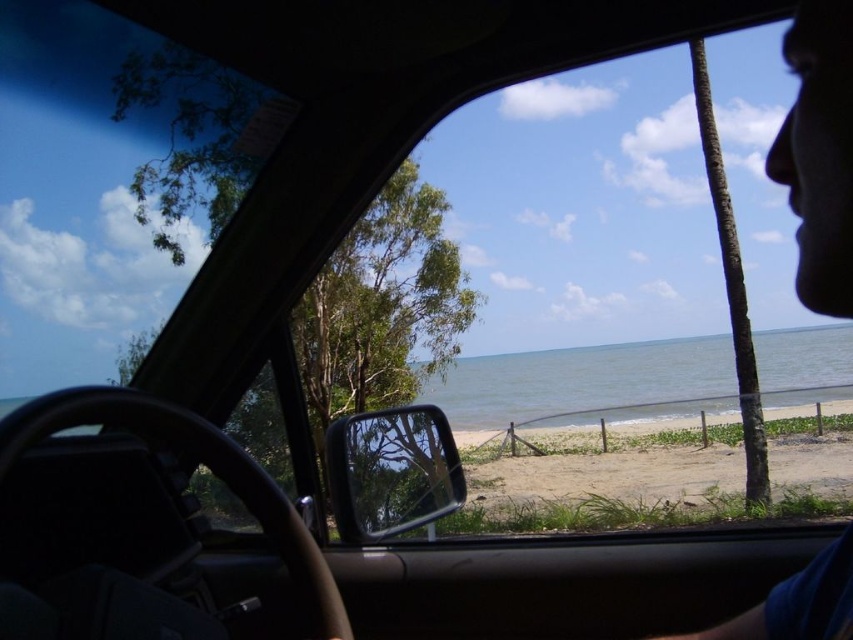
Question: Which point is farther to the camera?

Choices:
 (A) (813, 618)
 (B) (349, 424)

Answer: (B)

Question: Is sandy beach at lower center to the left of blue fabric face at upper right from the viewer's perspective?

Choices:
 (A) yes
 (B) no

Answer: (B)

Question: Is sandy beach at lower center below blue fabric face at upper right?

Choices:
 (A) yes
 (B) no

Answer: (A)

Question: From the image, what is the correct spatial relationship of sandy beach at lower center in relation to blue fabric face at upper right?

Choices:
 (A) left
 (B) right

Answer: (B)